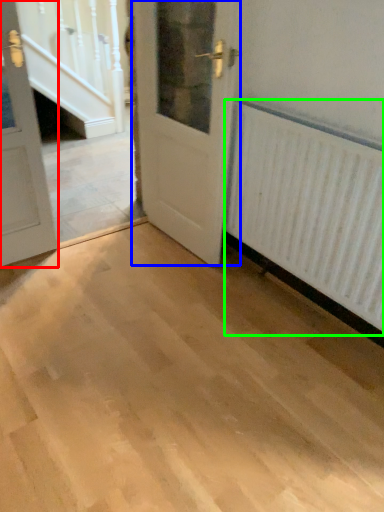
Question: Based on their relative distances, which object is farther from door (highlighted by a red box)? Choose from door (highlighted by a blue box) and radiator (highlighted by a green box).

Choices:
 (A) door
 (B) radiator

Answer: (B)